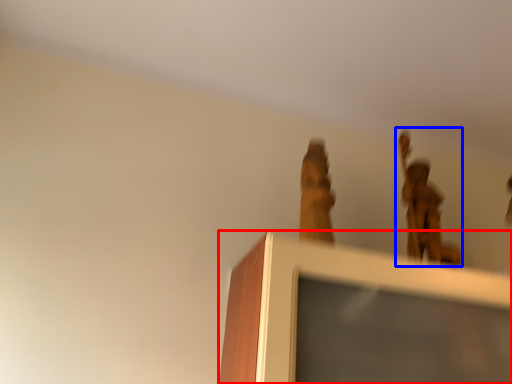
Question: Which object is further to the camera taking this photo, furniture (highlighted by a red box) or bronze statue (highlighted by a blue box)?

Choices:
 (A) furniture
 (B) bronze statue

Answer: (B)